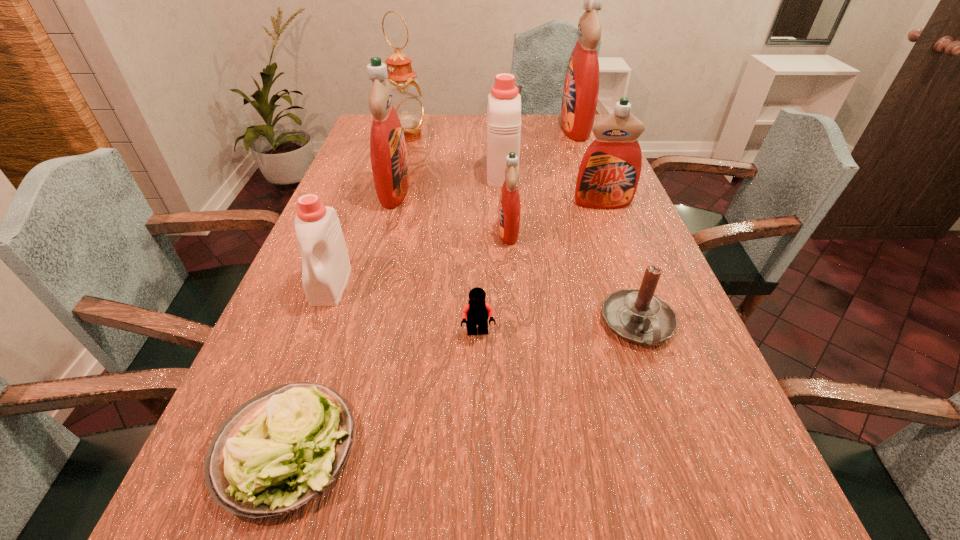
This screenshot has width=960, height=540. In order to click on the biggest red detergent in this screenshot , I will do `click(581, 87)`.

At what (x,y) coordinates should I click in order to perform the action: click on the tallest detergent. Please return your answer as a coordinate pair (x, y). Looking at the image, I should click on (581, 87).

Identify the location of oil lamp. (406, 99).

Identify the location of the second tallest detergent. This screenshot has width=960, height=540. (388, 153).

Locate an element on the screen. the second detergent from left to right is located at coordinates (388, 153).

The height and width of the screenshot is (540, 960). I want to click on the right white detergent, so click(x=504, y=103).

Find the location of a particular element. Image resolution: width=960 pixels, height=540 pixels. the farther white detergent is located at coordinates (504, 103).

Locate an element on the screen. the third biggest red detergent is located at coordinates (608, 176).

The image size is (960, 540). In order to click on the left white detergent in this screenshot , I will do `click(326, 267)`.

The image size is (960, 540). Find the location of `the smaller white detergent`. the smaller white detergent is located at coordinates (326, 267).